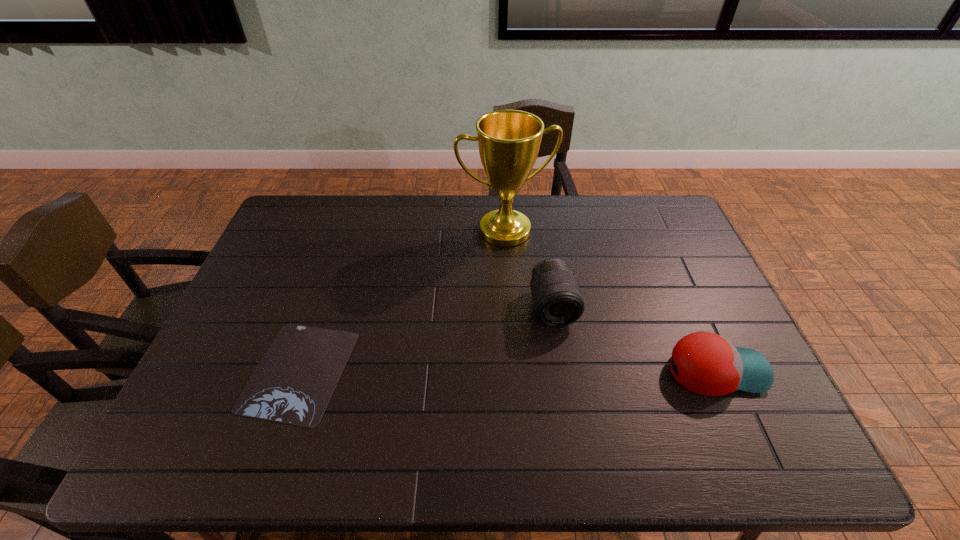
The height and width of the screenshot is (540, 960). In order to click on vacant space on the desktop that is between the leftmost object and the rightmost object and is positioned on the surface of the telephoto lens in this screenshot , I will do `click(567, 370)`.

What are the coordinates of `vacant space on the desktop that is between the leftmost object and the rightmost object and is positioned by the handles of the tallest object` in the screenshot? It's located at (560, 370).